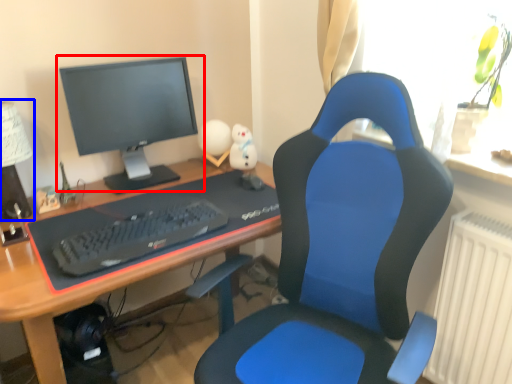
Question: Which point is further to the camera, computer monitor (highlighted by a red box) or table lamp (highlighted by a blue box)?

Choices:
 (A) computer monitor
 (B) table lamp

Answer: (A)